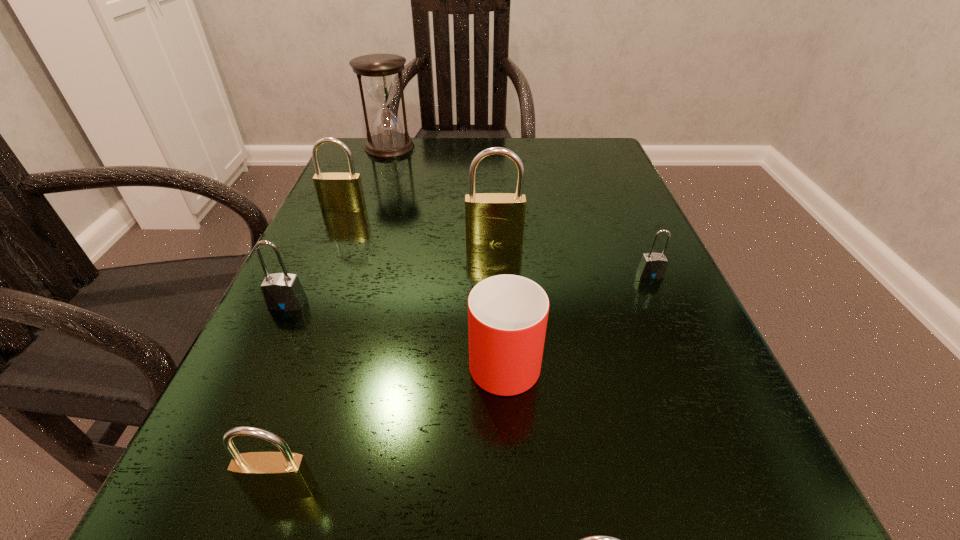
At what (x,y) coordinates should I click in order to perform the action: click on vacant area that lies between the cup and the farthest object. Please return your answer as a coordinate pair (x, y). Looking at the image, I should click on (447, 251).

Locate an element on the screen. This screenshot has height=540, width=960. vacant area that lies between the fourth nearest object and the cup is located at coordinates (396, 329).

The width and height of the screenshot is (960, 540). I want to click on blank region between the third nearest padlock and the red cup, so click(x=396, y=329).

Locate which object is the fifth closest to the second nearest padlock. Please provide its 2D coordinates. Your answer should be formatted as a tuple, i.e. [(x, y)], where the tuple contains the x and y coordinates of a point satisfying the conditions above.

[(337, 192)]

Select which object is the seventh closest to the cup. Please provide its 2D coordinates. Your answer should be formatted as a tuple, i.e. [(x, y)], where the tuple contains the x and y coordinates of a point satisfying the conditions above.

[(379, 71)]

The width and height of the screenshot is (960, 540). In order to click on padlock that is the fourth nearest to the hourglass in this screenshot , I will do `click(652, 265)`.

This screenshot has width=960, height=540. I want to click on padlock that is the closest to the third biggest brass padlock, so click(x=281, y=291).

What are the coordinates of `brass padlock that can be found as the closest to the fifth shortest padlock` in the screenshot? It's located at (491, 218).

Find the location of a particular element. This screenshot has height=540, width=960. brass padlock that is the closest to the seventh farthest object is located at coordinates (597, 539).